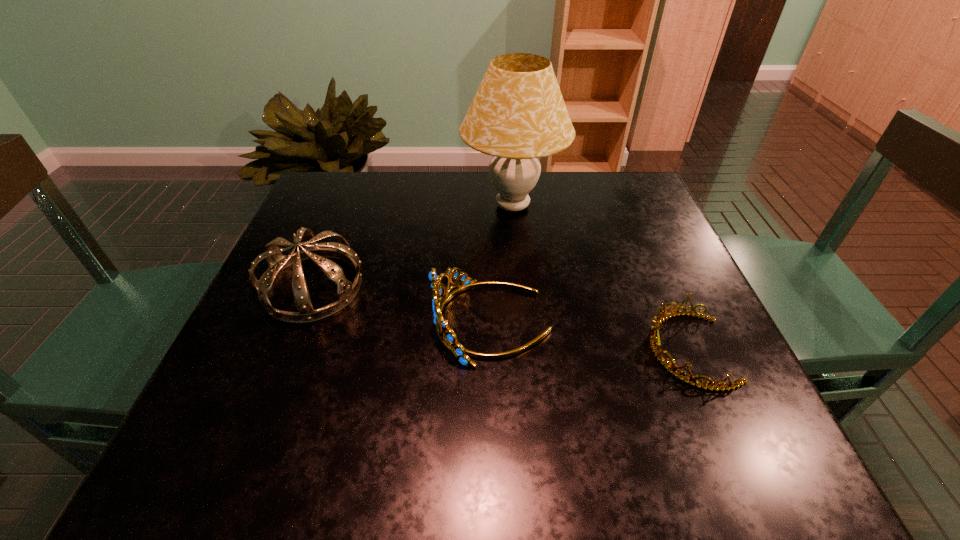
At what (x,y) coordinates should I click in order to perform the action: click on unoccupied position between the second tiara from right to left and the leftmost tiara. Please return your answer as a coordinate pair (x, y). The height and width of the screenshot is (540, 960). Looking at the image, I should click on (402, 305).

Find the location of a particular element. Image resolution: width=960 pixels, height=540 pixels. free space between the leftmost tiara and the farthest object is located at coordinates (413, 246).

Where is `empty space that is in between the leftmost object and the tallest object`? The height and width of the screenshot is (540, 960). empty space that is in between the leftmost object and the tallest object is located at coordinates (413, 246).

Where is `object that ranks as the second closest to the shortest tiara`? This screenshot has width=960, height=540. object that ranks as the second closest to the shortest tiara is located at coordinates (518, 115).

This screenshot has height=540, width=960. Find the location of `object that is the closest to the second tiara from right to left`. object that is the closest to the second tiara from right to left is located at coordinates (346, 291).

This screenshot has width=960, height=540. What are the coordinates of `the closest tiara to the rightmost object` in the screenshot? It's located at (447, 337).

This screenshot has height=540, width=960. What are the coordinates of `the closest tiara relative to the leftmost object` in the screenshot? It's located at 447,337.

Locate an element on the screen. The image size is (960, 540). blank space that satisfies the following two spatial constraints: 1. on the back side of the lampshade; 2. on the right side of the leftmost tiara is located at coordinates (345, 206).